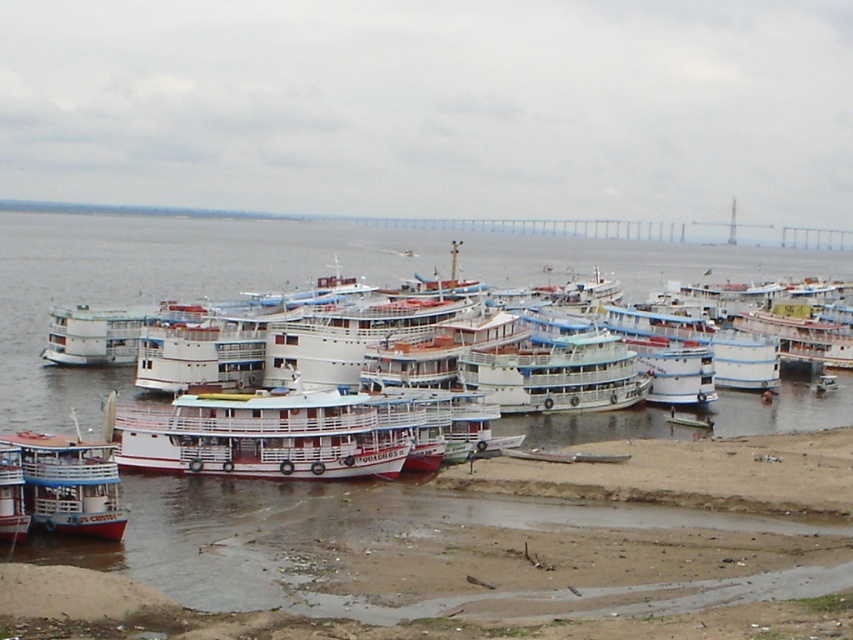
From the picture: You are standing on the riverbank and want to board the white matte boat at center. Based on its position coordinates, is it closer to the left or right side of the river?

The white matte boat at center is positioned at coordinates point (260, 436), which places it closer to the right side of the river.

You are a tour guide who needs to board passengers onto the white matte boat at center and the white glossy boat at lower left. Which boat requires a taller boarding ramp due to its height?

The white matte boat at center requires a taller boarding ramp because it is much taller than the white glossy boat at lower left according to the description.

From the picture: You are a tour guide planning a sightseeing trip. You need to choose between the white matte boat at center and the white glossy boat at lower left. Which boat offers more space for passengers?

The white matte boat at center is larger in size compared to the white glossy boat at lower left, so it offers more space for passengers.